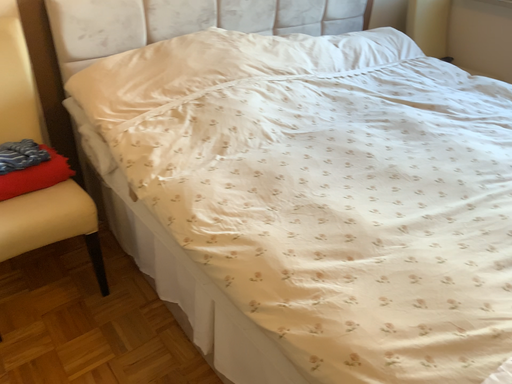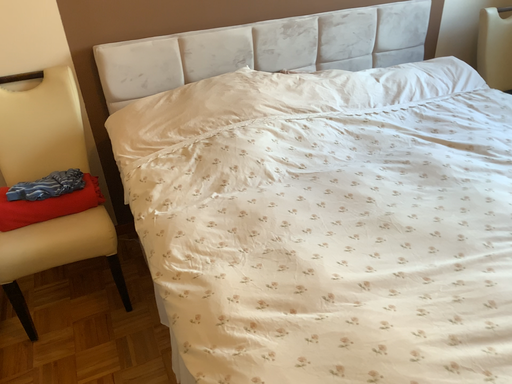
Question: Which way did the camera rotate in the video?

Choices:
 (A) rotated right
 (B) rotated left

Answer: (B)